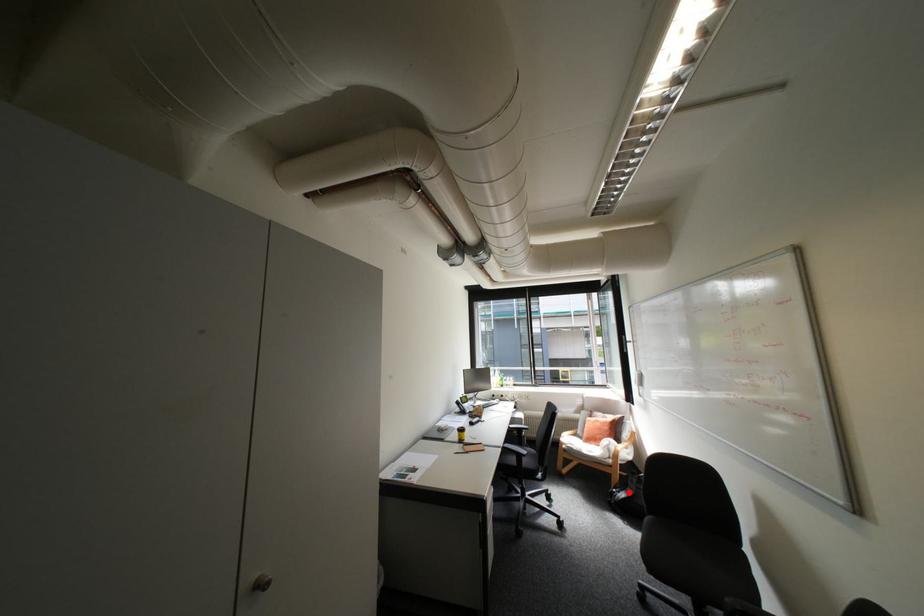
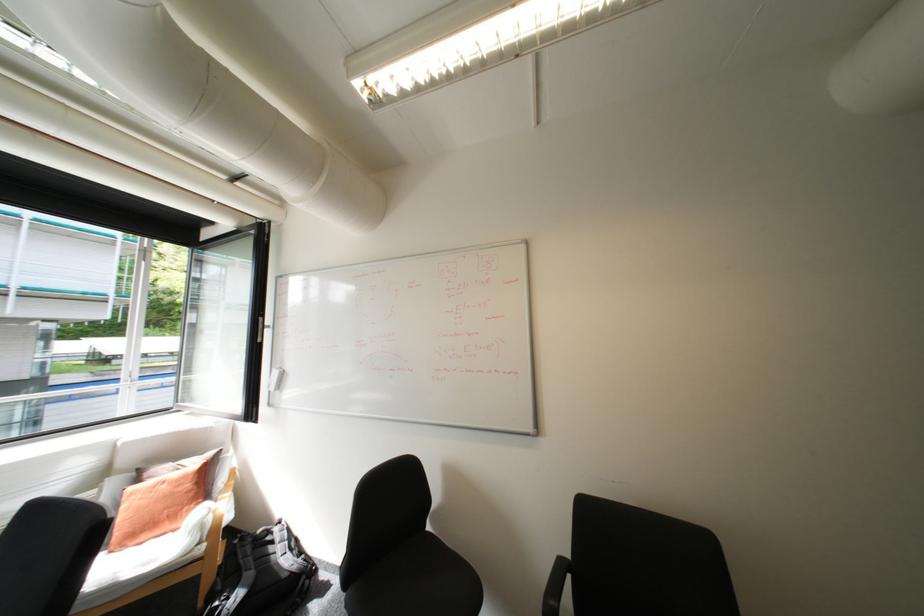
In the second image, find the point that corresponds to the highlighted location in the first image.

(238, 599)